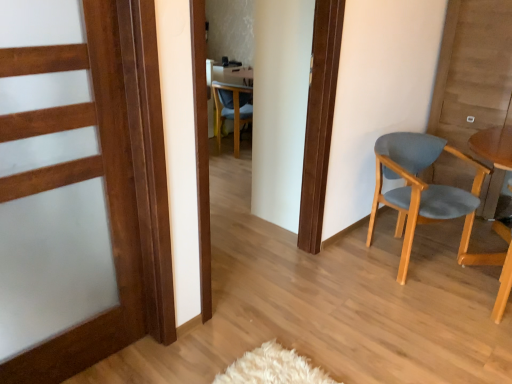
Question: From a real-world perspective, is wooden door at left physically above light blue fabric chair at right, the second chair when ordered from top to bottom?

Choices:
 (A) yes
 (B) no

Answer: (A)

Question: Can you confirm if wooden door at left is taller than light blue fabric chair at right, arranged as the first chair when viewed from the right?

Choices:
 (A) no
 (B) yes

Answer: (B)

Question: From the image's perspective, is wooden door at left on light blue fabric chair at right, the 1th chair positioned from the bottom?

Choices:
 (A) no
 (B) yes

Answer: (A)

Question: From a real-world perspective, is wooden door at left positioned under light blue fabric chair at right, the 1th chair positioned from the bottom, based on gravity?

Choices:
 (A) no
 (B) yes

Answer: (A)

Question: Is wooden door at left to the left of light blue fabric chair at right, the second chair when ordered from top to bottom, from the viewer's perspective?

Choices:
 (A) no
 (B) yes

Answer: (B)

Question: Considering their positions, is wooden door at left located in front of or behind blue fabric chair at center, the second chair from the bottom?

Choices:
 (A) front
 (B) behind

Answer: (A)

Question: From a real-world perspective, is wooden door at left positioned above or below blue fabric chair at center, the 1th chair positioned from the back?

Choices:
 (A) above
 (B) below

Answer: (A)

Question: Considering the positions of wooden door at left and blue fabric chair at center, the 1th chair positioned from the back, in the image, is wooden door at left bigger or smaller than blue fabric chair at center, the 1th chair positioned from the back,?

Choices:
 (A) big
 (B) small

Answer: (B)

Question: Which is correct: wooden door at left is inside blue fabric chair at center, the 1th chair positioned from the back, or outside of it?

Choices:
 (A) outside
 (B) inside

Answer: (A)

Question: In the image, is light blue fabric chair at right, the 1th chair positioned from the bottom, positioned in front of or behind blue fabric chair at center, which is counted as the second chair, starting from the front?

Choices:
 (A) behind
 (B) front

Answer: (B)

Question: Is light blue fabric chair at right, placed as the second chair when sorted from left to right, spatially inside blue fabric chair at center, the 1th chair positioned from the back, or outside of it?

Choices:
 (A) outside
 (B) inside

Answer: (A)

Question: Is light blue fabric chair at right, which ranks as the second chair in back-to-front order, taller or shorter than blue fabric chair at center, the second chair from the bottom?

Choices:
 (A) tall
 (B) short

Answer: (A)

Question: Does point (449, 195) appear closer or farther from the camera than point (239, 144)?

Choices:
 (A) farther
 (B) closer

Answer: (B)

Question: Considering the relative positions of wooden door at left and light blue fabric chair at right, the second chair when ordered from top to bottom, in the image provided, is wooden door at left to the left or to the right of light blue fabric chair at right, the second chair when ordered from top to bottom,?

Choices:
 (A) right
 (B) left

Answer: (B)

Question: From the image's perspective, is wooden door at left positioned above or below light blue fabric chair at right, which ranks as the second chair in back-to-front order?

Choices:
 (A) above
 (B) below

Answer: (B)